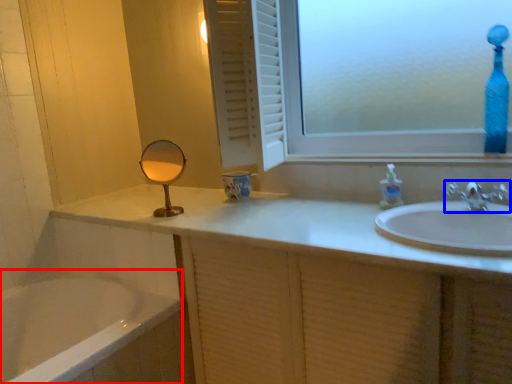
Question: Which of the following is the closest to the observer, bath (highlighted by a red box) or tap (highlighted by a blue box)?

Choices:
 (A) bath
 (B) tap

Answer: (A)